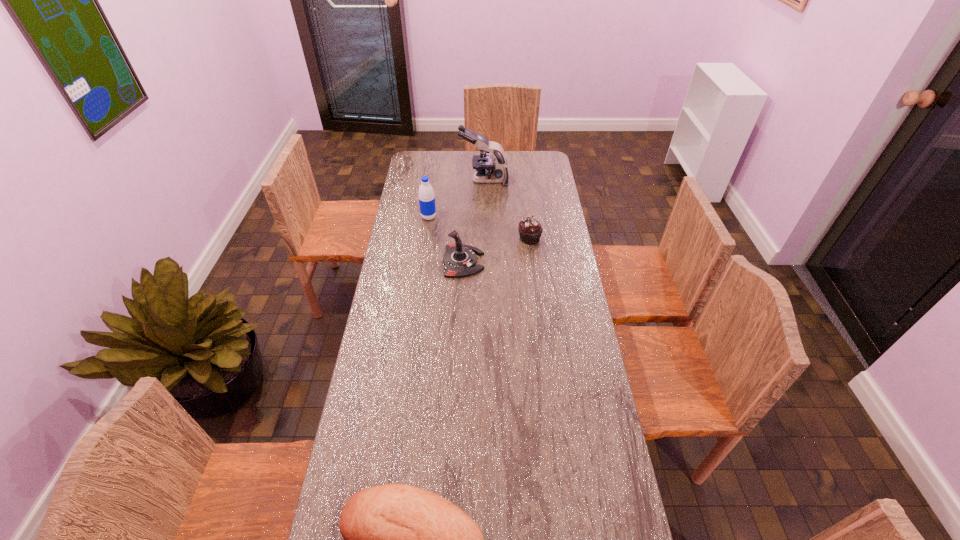
Find the location of `vacant region located on the handle side of the third tallest object`. vacant region located on the handle side of the third tallest object is located at coordinates (573, 262).

You are a GUI agent. You are given a task and a screenshot of the screen. Output one action in this format:
    pyautogui.click(x=<x>, y=<y>)
    Task: Click on the vacant area located 0.350m on the left of the rightmost object
    The width and height of the screenshot is (960, 540).
    Given the screenshot: What is the action you would take?
    pyautogui.click(x=440, y=239)

Locate an element on the screen. object present at the far edge is located at coordinates (488, 169).

Image resolution: width=960 pixels, height=540 pixels. I want to click on object located in the left edge section of the desktop, so click(x=426, y=194).

I want to click on object that is at the right edge, so click(x=530, y=230).

This screenshot has width=960, height=540. I want to click on vacant region at the far edge, so click(444, 166).

Where is `free space at the left edge`? free space at the left edge is located at coordinates click(387, 434).

Locate an element on the screen. Image resolution: width=960 pixels, height=540 pixels. free space at the right edge is located at coordinates (546, 213).

The image size is (960, 540). In the image, there is a desktop. Find the location of `vacant space at the far left corner`. vacant space at the far left corner is located at coordinates (427, 153).

This screenshot has width=960, height=540. Find the location of `blank space at the far right corner`. blank space at the far right corner is located at coordinates (536, 158).